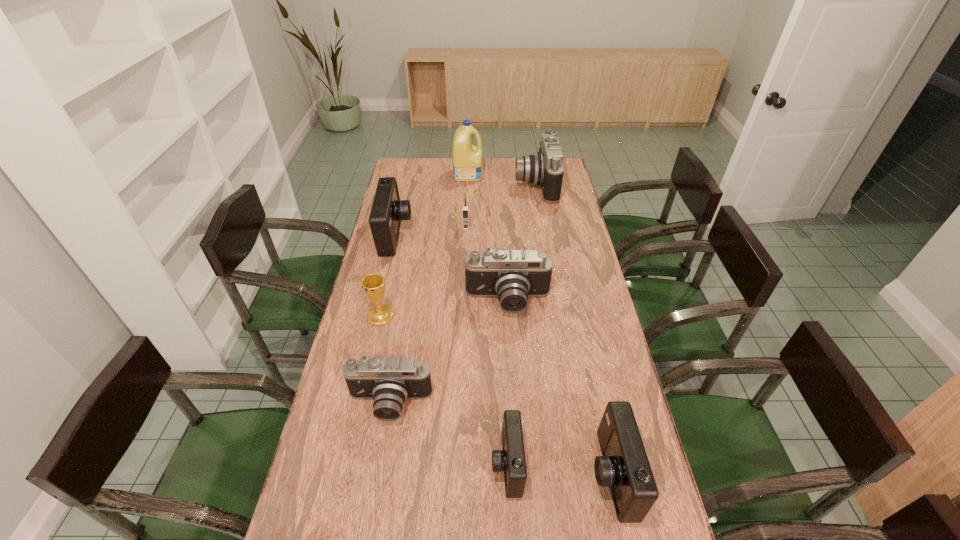
Locate an element on the screen. This screenshot has height=540, width=960. object identified as the closest to the chalice is located at coordinates (388, 381).

Find the location of `object that is the second nearest to the cellular telephone`. object that is the second nearest to the cellular telephone is located at coordinates (545, 168).

Locate an element on the screen. Image resolution: width=960 pixels, height=540 pixels. camera that is the fifth closest to the tallest object is located at coordinates (511, 460).

Image resolution: width=960 pixels, height=540 pixels. Find the location of `camera that is the closest to the gold chalice`. camera that is the closest to the gold chalice is located at coordinates (388, 381).

The width and height of the screenshot is (960, 540). Find the location of `black camera that stands as the closest to the cellular telephone`. black camera that stands as the closest to the cellular telephone is located at coordinates (545, 168).

Select which black camera is the second closest to the detergent. Please provide its 2D coordinates. Your answer should be formatted as a tuple, i.e. [(x, y)], where the tuple contains the x and y coordinates of a point satisfying the conditions above.

[(512, 275)]

Identify the location of blue camera that stands as the closest to the smallest black camera. The image size is (960, 540). (511, 460).

At what (x,y) coordinates should I click in order to perform the action: click on the closest blue camera to the fifth nearest camera. Please return your answer as a coordinate pair (x, y). Looking at the image, I should click on pos(511,460).

The height and width of the screenshot is (540, 960). I want to click on vacant region that satisfies the following two spatial constraints: 1. on the label of the detergent; 2. on the front side of the chalice, so click(463, 316).

Find the location of a particular element. Image resolution: width=960 pixels, height=540 pixels. free region that satisfies the following two spatial constraints: 1. on the label of the tallest object; 2. on the front side of the chalice is located at coordinates (463, 316).